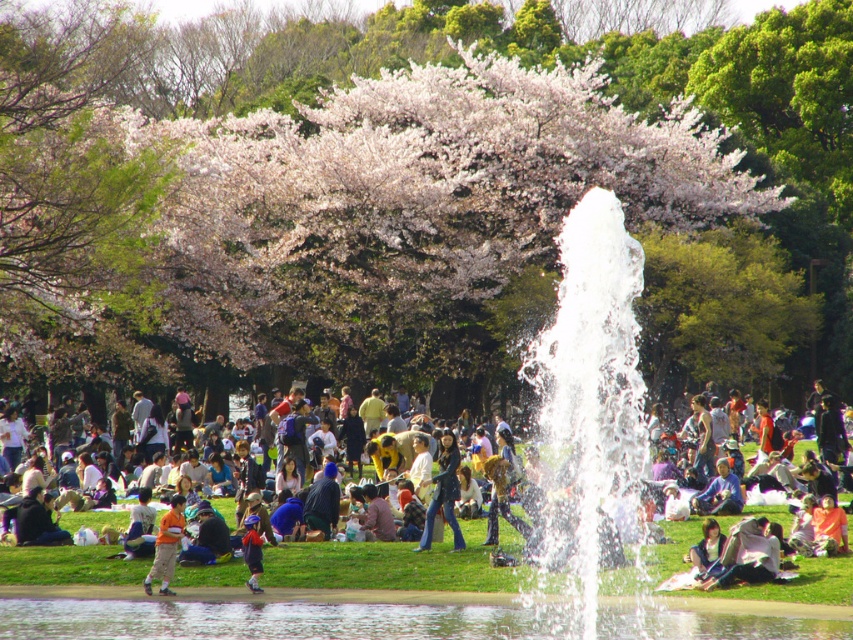
Does matte black jacket at center appear on the left side of blue denim jacket at lower center?

In fact, matte black jacket at center is to the right of blue denim jacket at lower center.

Who is taller, matte black jacket at center or blue denim jacket at lower center?

With more height is blue denim jacket at lower center.

The width and height of the screenshot is (853, 640). I want to click on matte black jacket at center, so click(x=387, y=564).

Who is more forward, (165, 516) or (258, 584)?

Point (258, 584)

Is orange cotton shirt at lower left smaller than blue denim jacket at lower center?

Actually, orange cotton shirt at lower left might be larger than blue denim jacket at lower center.

The image size is (853, 640). Describe the element at coordinates (166, 547) in the screenshot. I see `orange cotton shirt at lower left` at that location.

Image resolution: width=853 pixels, height=640 pixels. In order to click on orange cotton shirt at lower left in this screenshot , I will do tap(166, 547).

Can you confirm if transparent glass water at center is taller than orange cotton shirt at lower left?

No.

Is transparent glass water at center positioned in front of orange cotton shirt at lower left?

Yes, transparent glass water at center is closer to the viewer.

What do you see at coordinates (276, 620) in the screenshot? The width and height of the screenshot is (853, 640). I see `transparent glass water at center` at bounding box center [276, 620].

At what (x,y) coordinates should I click in order to perform the action: click on transparent glass water at center. Please return your answer as a coordinate pair (x, y). This screenshot has width=853, height=640. Looking at the image, I should click on (276, 620).